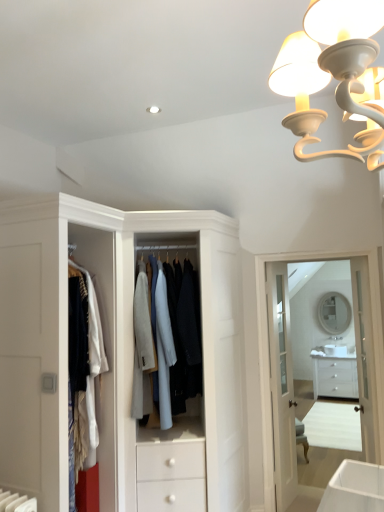
Image resolution: width=384 pixels, height=512 pixels. In order to click on vacant area located to the right-hand side of white glossy door at center, acting as the first door starting from the left in this screenshot , I will do `click(307, 505)`.